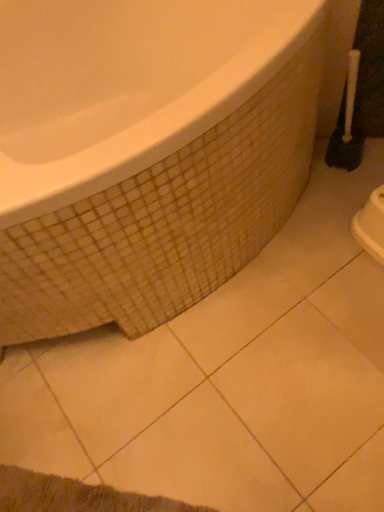
Question: Is there a large distance between white glossy bathtub at upper left and white plastic toilet brush at right?

Choices:
 (A) yes
 (B) no

Answer: (B)

Question: Can white plastic toilet brush at right be found inside white glossy bathtub at upper left?

Choices:
 (A) no
 (B) yes

Answer: (A)

Question: Does white glossy bathtub at upper left have a lesser height compared to white plastic toilet brush at right?

Choices:
 (A) yes
 (B) no

Answer: (B)

Question: Is white glossy bathtub at upper left to the left of white plastic toilet brush at right from the viewer's perspective?

Choices:
 (A) no
 (B) yes

Answer: (B)

Question: Is white glossy bathtub at upper left completely or partially outside of white plastic toilet brush at right?

Choices:
 (A) no
 (B) yes

Answer: (B)

Question: Does white glossy bathtub at upper left have a greater height compared to white plastic toilet brush at right?

Choices:
 (A) yes
 (B) no

Answer: (A)

Question: From a real-world perspective, is white plastic toilet brush at right on top of white glossy bathtub at upper left?

Choices:
 (A) yes
 (B) no

Answer: (B)

Question: Can white glossy bathtub at upper left be found inside white plastic toilet brush at right?

Choices:
 (A) no
 (B) yes

Answer: (A)

Question: Is white plastic toilet brush at right placed right next to white glossy bathtub at upper left?

Choices:
 (A) yes
 (B) no

Answer: (B)

Question: Could you tell me if white plastic toilet brush at right is facing white glossy bathtub at upper left?

Choices:
 (A) no
 (B) yes

Answer: (B)

Question: From the image's perspective, would you say white plastic toilet brush at right is positioned over white glossy bathtub at upper left?

Choices:
 (A) yes
 (B) no

Answer: (A)

Question: Is white plastic toilet brush at right wider than white glossy bathtub at upper left?

Choices:
 (A) no
 (B) yes

Answer: (A)

Question: Is white plastic toilet brush at right bigger or smaller than white glossy bathtub at upper left?

Choices:
 (A) big
 (B) small

Answer: (B)